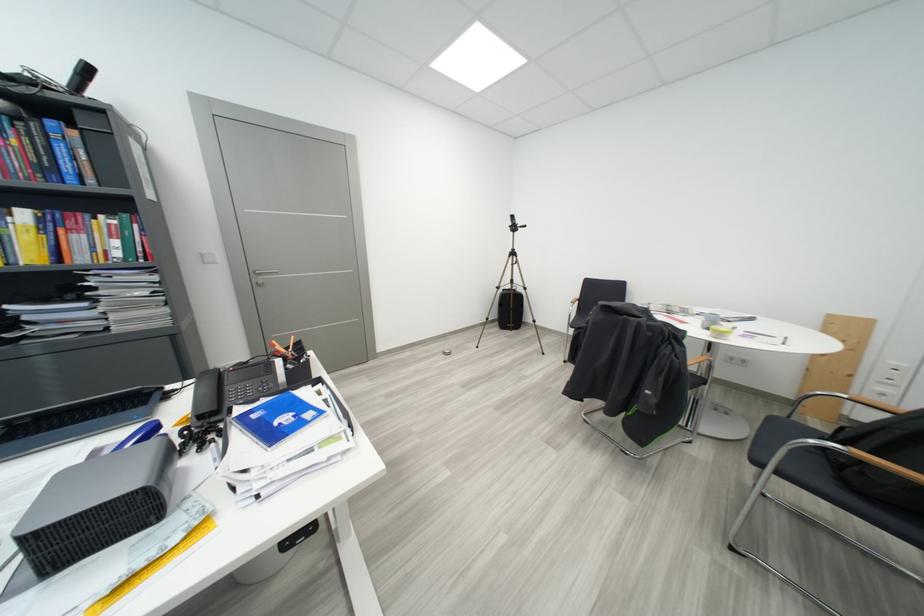
Where would you turn the tripod adjustment knob? Please return your answer as a coordinate pair (x, y).

(514, 230)